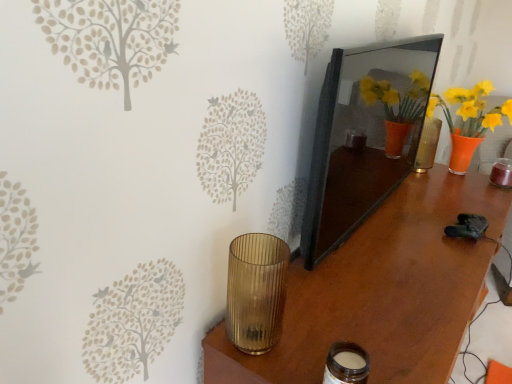
I want to click on free space behind matte glass jar at lower center, which appears as the second candle holder when viewed from the left, so click(328, 325).